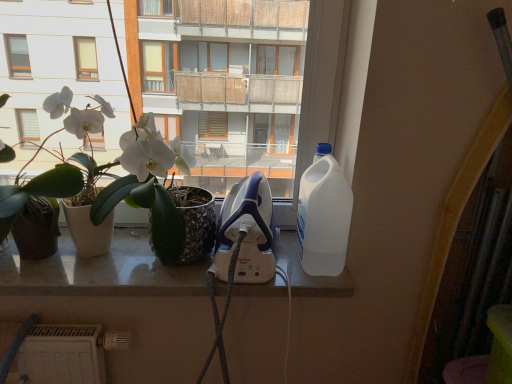
Question: In the image, is green matte plant at left, the 1th houseplant in the left-to-right sequence, on the left side or the right side of white glossy iron at center?

Choices:
 (A) right
 (B) left

Answer: (B)

Question: In terms of height, does green matte plant at left, the 1th houseplant in the left-to-right sequence, look taller or shorter compared to white glossy iron at center?

Choices:
 (A) short
 (B) tall

Answer: (B)

Question: Which object is the closest to the white glossy iron at center?

Choices:
 (A) white plastic bottle at right
 (B) green matte plant at left, placed as the second houseplant when sorted from right to left
 (C) white matte plant pot at left, which is the 1th houseplant from right to left

Answer: (C)

Question: Which of these objects is positioned farthest from the white plastic bottle at right?

Choices:
 (A) green matte plant at left, the 1th houseplant in the left-to-right sequence
 (B) white glossy iron at center
 (C) white matte plant pot at left, acting as the second houseplant starting from the left

Answer: (A)